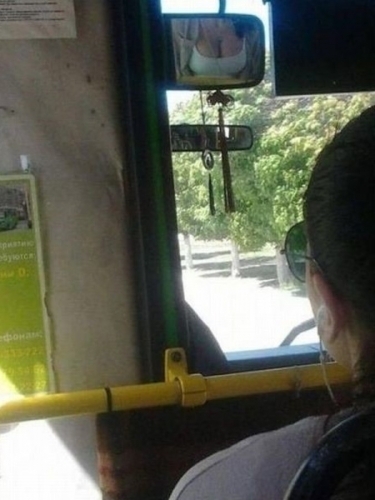
You are a GUI agent. You are given a task and a screenshot of the screen. Output one action in this format:
    pyautogui.click(x=<x>, y=<y>)
    Task: Click on the cable for headphones
    
    Given the screenshot: What is the action you would take?
    pyautogui.click(x=327, y=384)